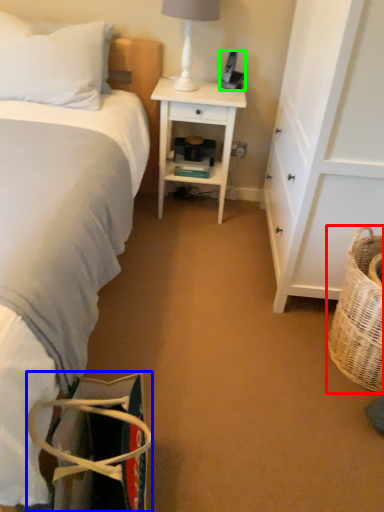
Question: Considering the real-world distances, which object is closest to picnic basket (highlighted by a red box)? handbag (highlighted by a blue box) or corded phone (highlighted by a green box).

Choices:
 (A) handbag
 (B) corded phone

Answer: (A)